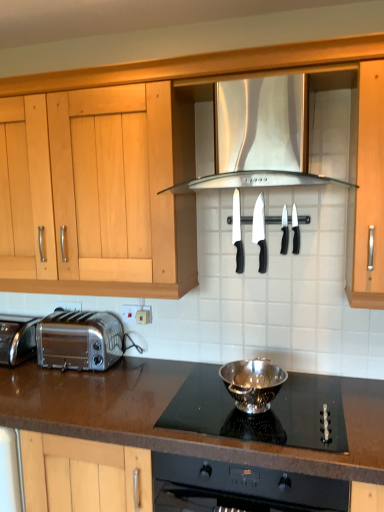
Where is `vacant space in front of silver metallic bowl at center, the 1th kitchen appliance in the front-to-back sequence`? This screenshot has height=512, width=384. vacant space in front of silver metallic bowl at center, the 1th kitchen appliance in the front-to-back sequence is located at coordinates (278, 434).